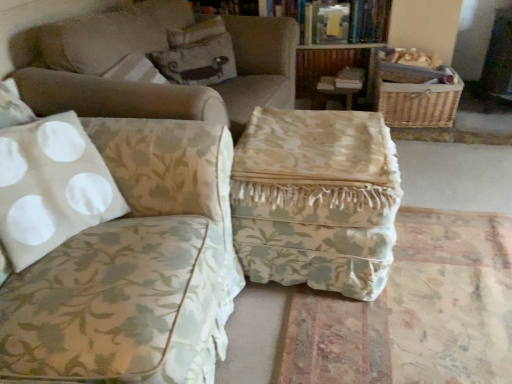
Find the location of a particular element. Image resolution: width=512 pixels, height=384 pixels. free region under floral fabric ottoman at center (from a real-world perspective) is located at coordinates coord(438,308).